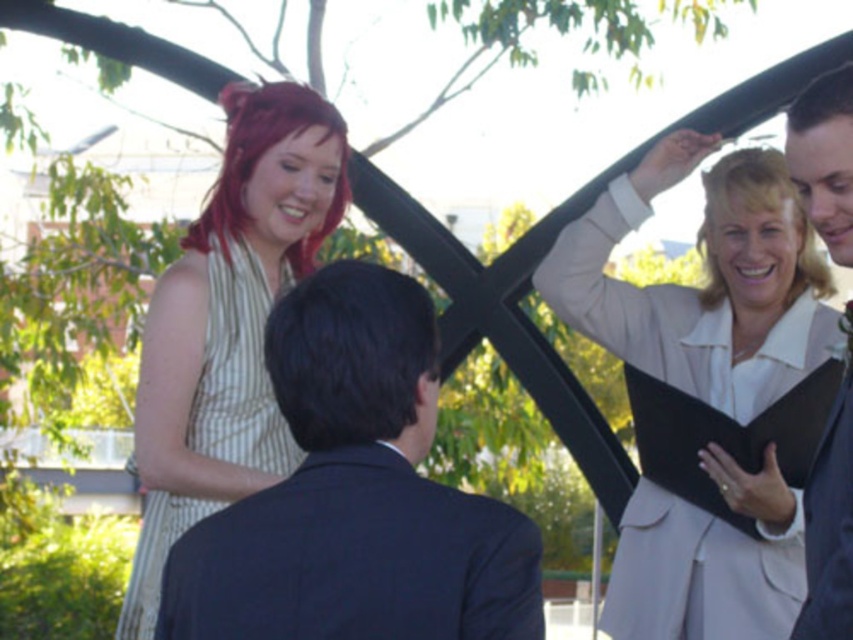
You are a photographer setting up for a group photo. You need to position two subjects wearing the dark blue suit at center and the dark suit jacket at upper right. Based on the scene, which subject should you place closer to the camera to ensure both are fully visible in the frame?

The dark blue suit at center should be placed closer to the camera because it might be wider than the dark suit jacket at upper right, ensuring both fit within the frame.

Consider the image. You are a photographer at the event and need to capture a photo that includes both the dark blue suit at center and the black matte clipboard at upper right. Based on their positions, which object will appear larger in the photo?

The dark blue suit at center will appear larger in the photo because it is closer to the viewer than the black matte clipboard at upper right.